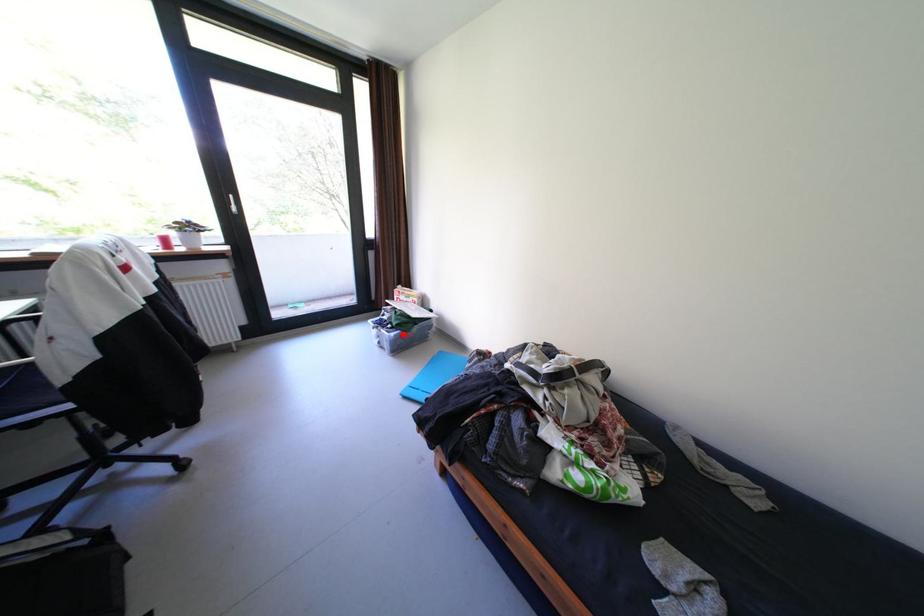
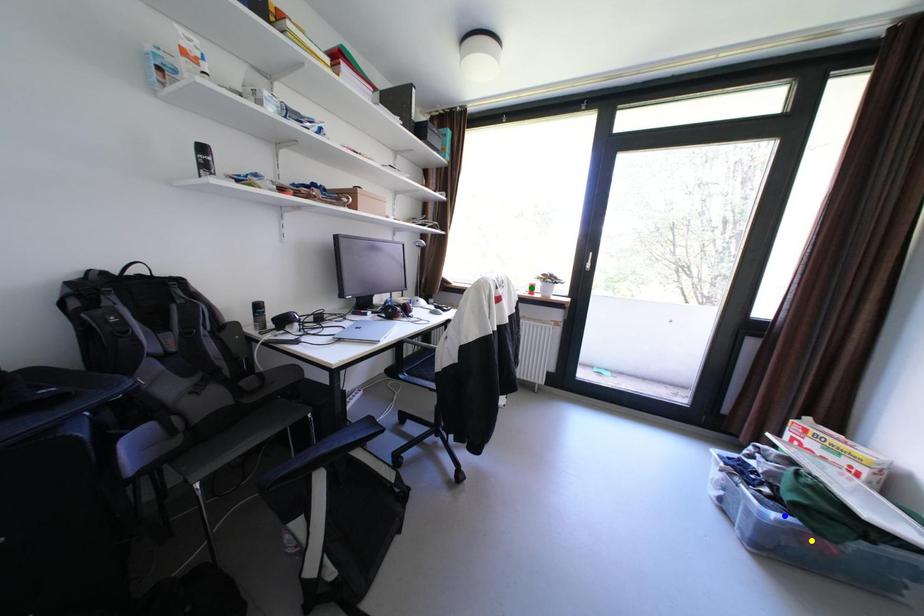
Question: I am providing you with two images of the same scene from different viewpoints. A red point is marked on the first image. You are given multiple points on the second image. Which point in image 2 is actually the same real-world point as the red point in image 1?

Choices:
 (A) yellow point
 (B) blue point
 (C) green point

Answer: (B)